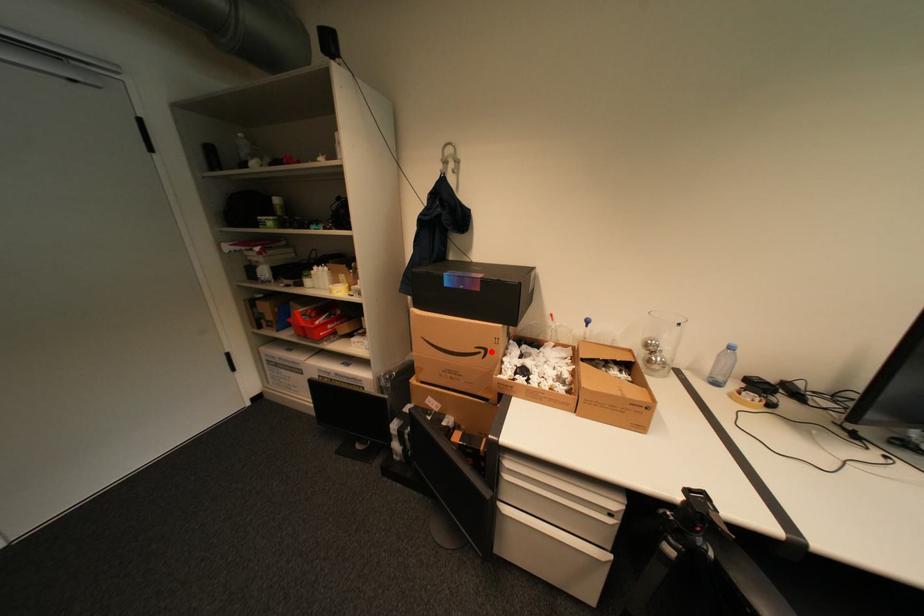
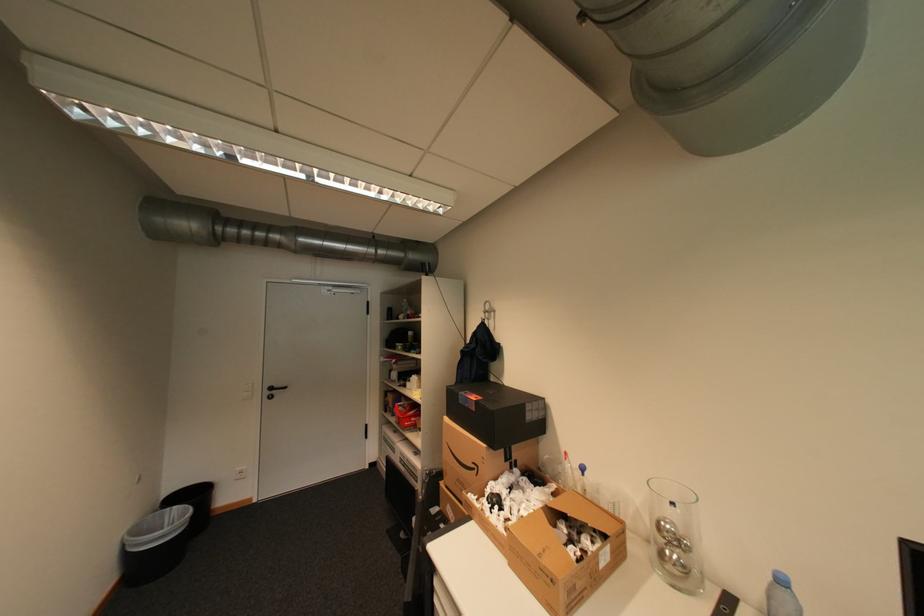
Question: I am providing you with two images of the same scene from different viewpoints. Image1 has a red point marked. In image2, the corresponding 3D location appears at what relative position? Reply with the corresponding letter.

Choices:
 (A) Closer
 (B) Farther

Answer: (B)